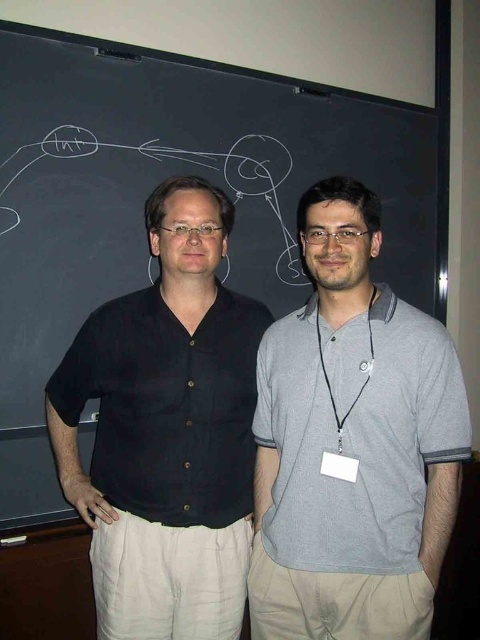
You are observing two people in front of a chalkboard. The person wearing the gray cotton polo shirt at center and the person wearing the black cotton shirt at left are standing in a certain position. Which person is standing lower in the image?

The gray cotton polo shirt at center is located below the black cotton shirt at left, so the person wearing the gray cotton polo shirt at center is standing lower in the image.